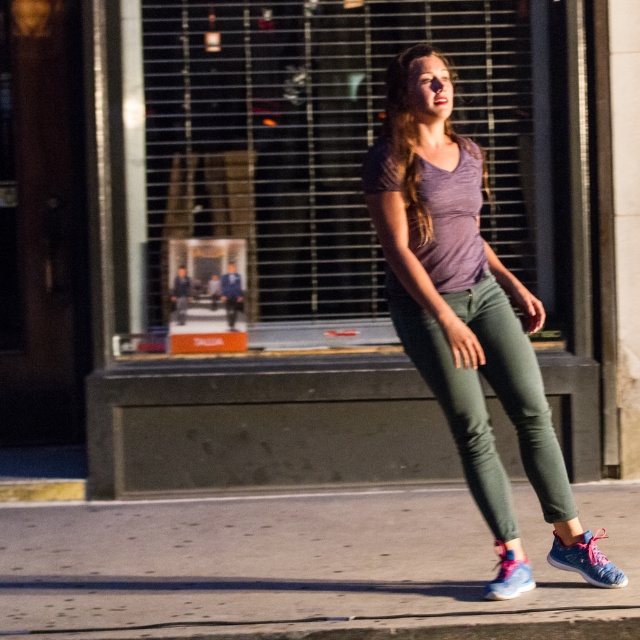
You are a delivery person trying to locate the entrance to the shop. You see a point marked at coordinates [332,144] on the matte glass shop window at center. Is the entrance to the shop located to the left or right of this point?

The entrance to the shop is not mentioned in the provided scene description. The point at coordinates [332,144] is on the matte glass shop window at center, but there is no information about the entrance location relative to this point.

You are a delivery person trying to deliver a package to the shop behind the matte glass shop window at center. You see the blue mesh sneaker at lower right on the sidewalk. Which direction should you walk to reach the shop window first?

You should walk to the left because the matte glass shop window at center is to the left of the blue mesh sneaker at lower right, so moving left will bring you closer to the shop window first.